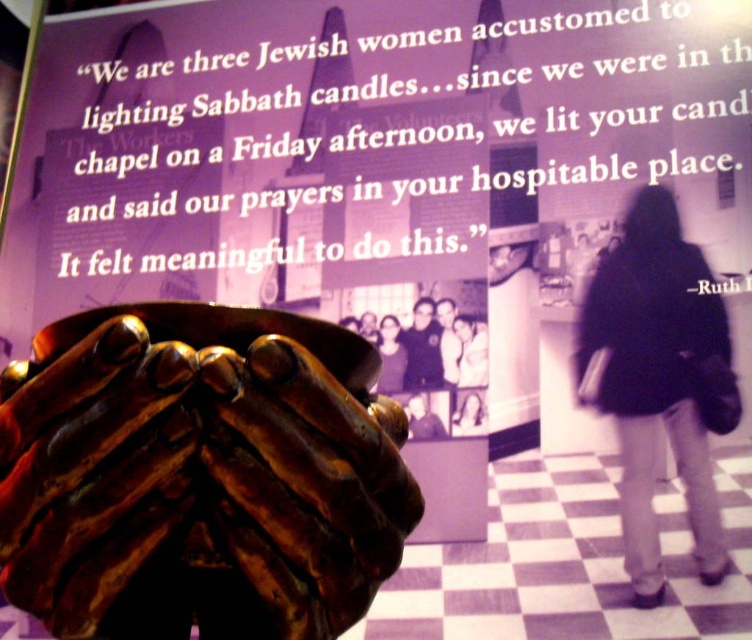
What is the exact coordinate of the shiny bronze hands at center?

The shiny bronze hands at center are located at point (199, 476).

You are a visitor at an art exhibit and want to take a photo of the shiny bronze hands at center and the dark fabric coat at lower right together in one frame. Your camera has a maximum zoom range that can capture objects up to 12 meters apart. Will you be able to capture both objects in a single photo?

The shiny bronze hands at center and dark fabric coat at lower right are 14.44 meters apart from each other. Since the camera can only capture up to 12 meters, you won